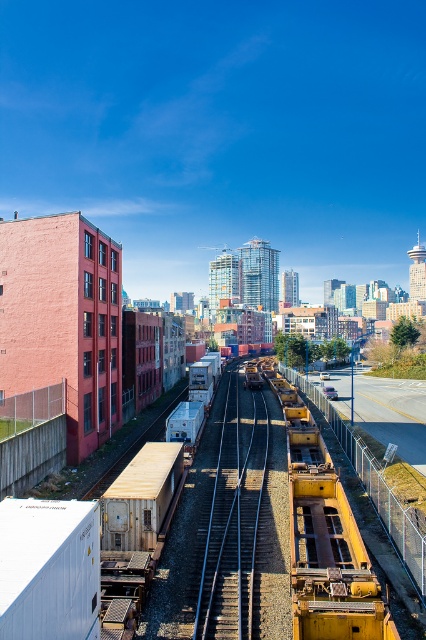
You are a delivery person trying to navigate a narrow alleyway between the rusty metal train car at center and the metallic silver train track at center. The alleyway is only 2 meters wide. Can you pass through safely if your delivery cart is 1.8 meters wide?

The rusty metal train car at center is wider than the metallic silver train track at center. However, the alleyway is 2 meters wide, which is slightly wider than your 1.8 meter delivery cart. As long as the combined width of the train car and track does not exceed the alleyway width, you should be able to pass through. But since the exact combined width isn not provided, it is uncertain.

You are a photographer standing at the edge of the railway. You want to take a photo that includes both the rusty metal train car at center and the metallic silver train track at center. Which object should you focus on first to ensure both are in sharp focus?

You should focus on the rusty metal train car at center first because it is closer to the viewer than the metallic silver train track at center. By focusing on the closer object, the track will also be in focus due to the depth of field.